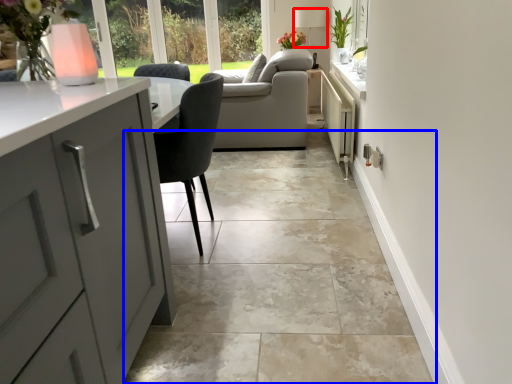
Question: Which point is closer to the camera, lamp (highlighted by a red box) or ceramic tile (highlighted by a blue box)?

Choices:
 (A) lamp
 (B) ceramic tile

Answer: (B)